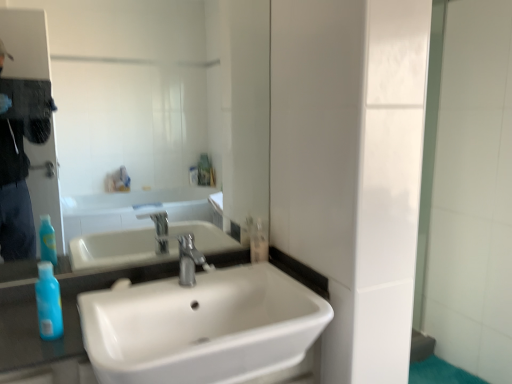
Question: From a real-world perspective, relative to clear plastic bottle at center, acting as the second mouthwash starting from the left, is blue translucent bottle at lower left, the 2th mouthwash from the back, vertically above or below?

Choices:
 (A) below
 (B) above

Answer: (A)

Question: Is blue translucent bottle at lower left, the 1th mouthwash when ordered from left to right, in front of or behind clear plastic bottle at center, positioned as the second mouthwash in front-to-back order, in the image?

Choices:
 (A) behind
 (B) front

Answer: (B)

Question: Which of these objects is positioned closest to the white glossy sink at center?

Choices:
 (A) clear plastic bottle at center, which is the 1th mouthwash from back to front
 (B) silver metallic faucet at center
 (C) blue translucent bottle at lower left, the 1th mouthwash when ordered from left to right
 (D) matte glass mirror at upper center

Answer: (B)

Question: Which of these objects is positioned closest to the clear plastic bottle at center, which is the 1th mouthwash from back to front?

Choices:
 (A) matte glass mirror at upper center
 (B) silver metallic faucet at center
 (C) white glossy sink at center
 (D) blue translucent bottle at lower left, the 2th mouthwash from the back

Answer: (B)